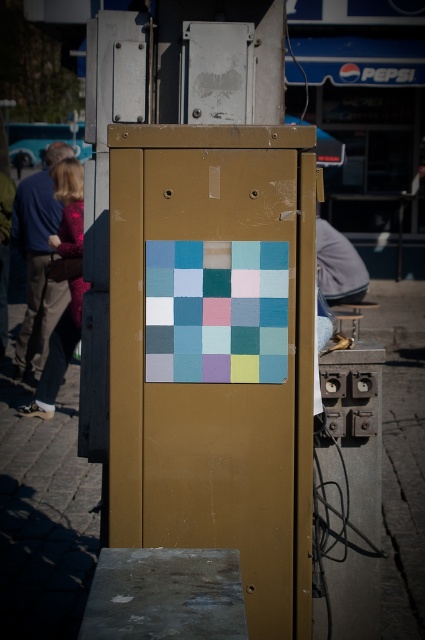
In the scene shown: You are a delivery person trying to park your small electric scooter. You see the gold metallic phone box at center and the matte concrete pavement at center. Where should you park your scooter to avoid blocking the phone box?

You should park the scooter on the matte concrete pavement at center since the gold metallic phone box at center is positioned over it, meaning the pavement is the flat area beneath the phone box.

You are a delivery robot with a 2.5 meter long package. You need to move the package from the gold metallic phone box at center to the matte concrete pavement at center. Can you move the package without needing to rotate it?

The gold metallic phone box at center is 3.21 meters away from matte concrete pavement at center. Since the package is only 2.5 meters long, the distance between them is sufficient for moving the package without rotation.